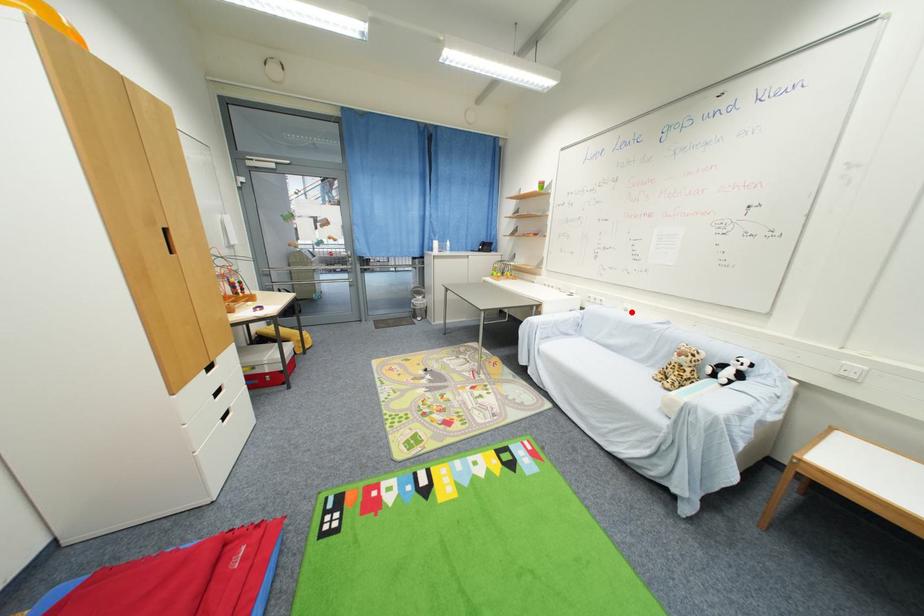
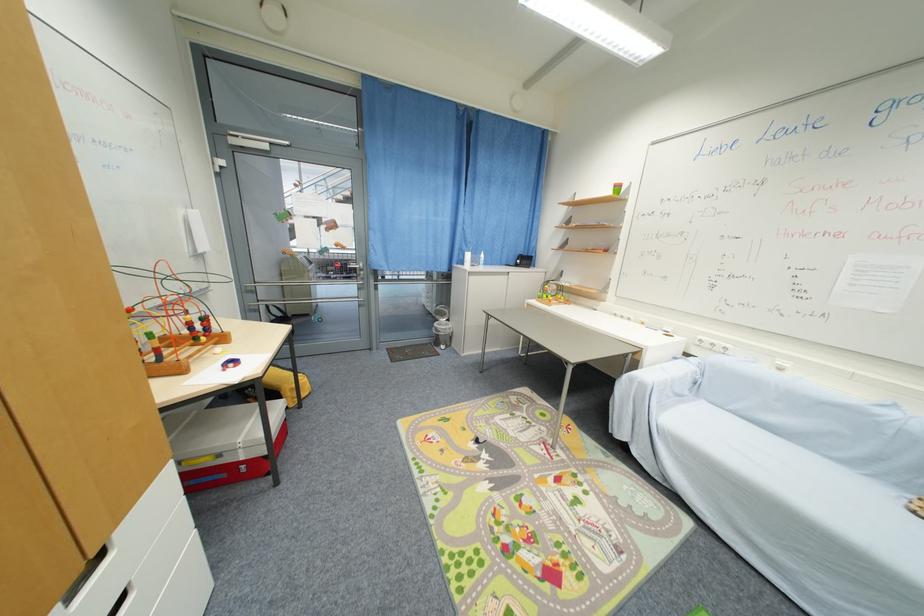
Where in the second image is the point corresponding to the highlighted location from the first image?

(785, 371)